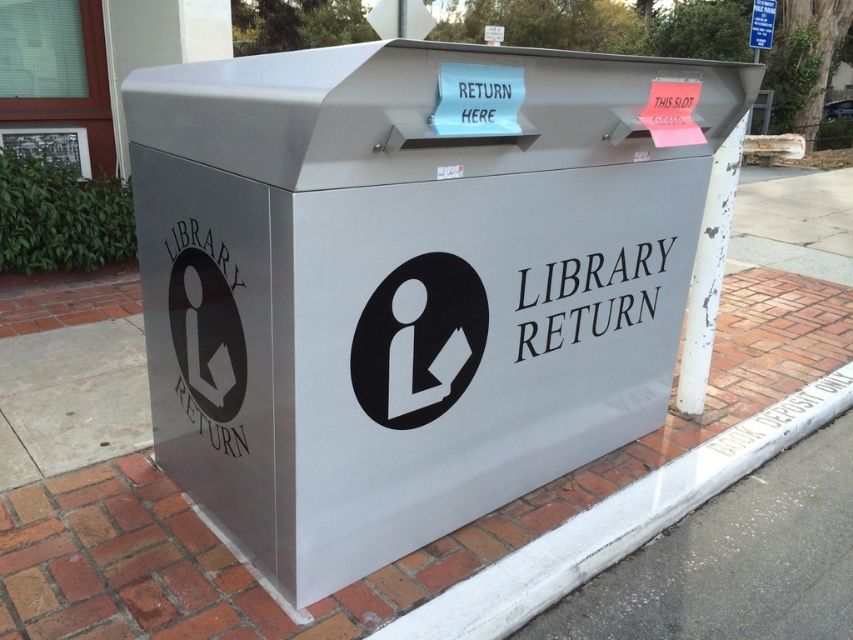
Question: Which of the following is the closest to the observer?

Choices:
 (A) (601, 541)
 (B) (180, 323)
 (C) (756, 29)

Answer: (B)

Question: Does metallic gray library return box at center have a smaller size compared to white concrete curb at lower right?

Choices:
 (A) yes
 (B) no

Answer: (B)

Question: Is metallic gray library return box at center bigger than black matte logo at lower left?

Choices:
 (A) yes
 (B) no

Answer: (A)

Question: Does white concrete curb at lower right appear on the right side of brushed metal sign at upper center?

Choices:
 (A) yes
 (B) no

Answer: (B)

Question: Which of the following is the farthest from the observer?

Choices:
 (A) brushed metal sign at upper center
 (B) black matte logo at center
 (C) white concrete curb at lower right

Answer: (A)

Question: Which is nearer to the metallic gray library return box at center?

Choices:
 (A) white concrete curb at lower right
 (B) black matte logo at lower left
 (C) black matte logo at center
 (D) brushed metal sign at upper center

Answer: (C)